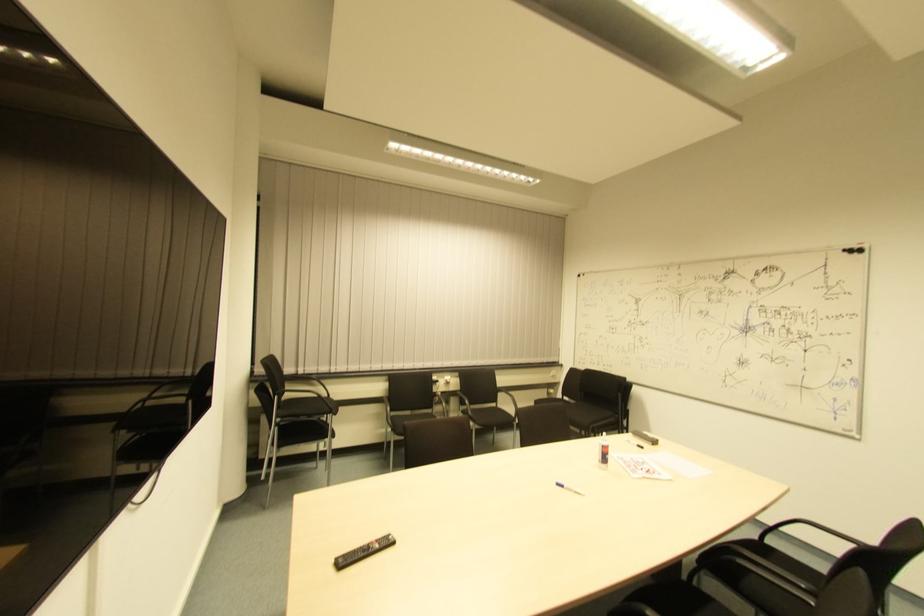
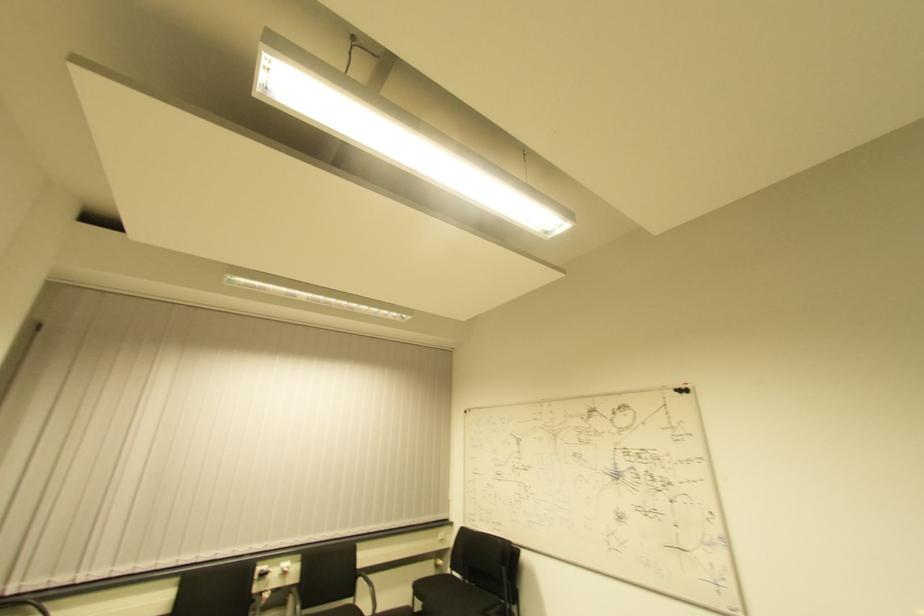
Locate, in the second image, the point that corresponds to point 560,368 in the first image.

(450, 527)